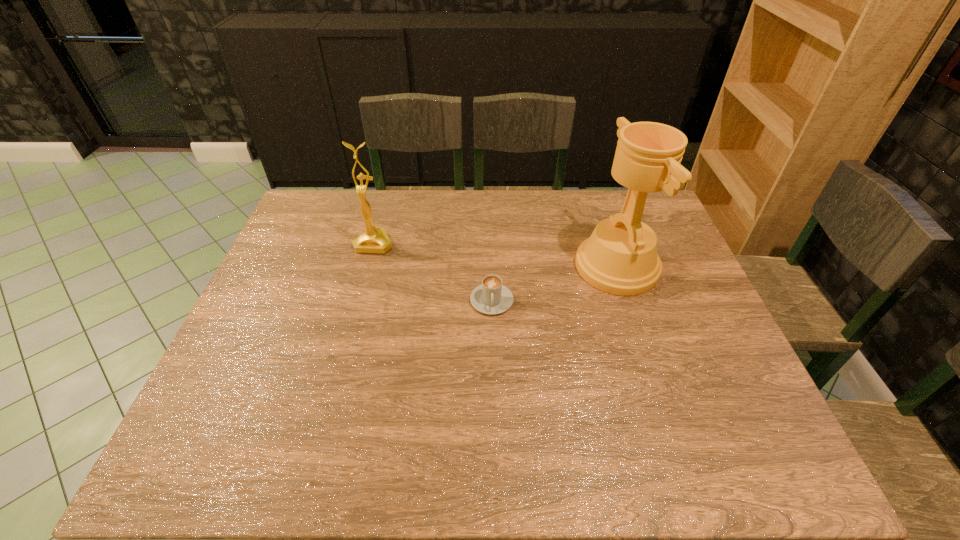
Find the location of a particular element. This screenshot has width=960, height=540. object situated at the right edge is located at coordinates (620, 257).

Locate an element on the screen. This screenshot has height=540, width=960. free space at the far edge is located at coordinates (564, 222).

Find the location of a particular element. This screenshot has height=540, width=960. vacant space at the near edge is located at coordinates (x=358, y=461).

Where is `blank space at the left edge of the desktop`? The width and height of the screenshot is (960, 540). blank space at the left edge of the desktop is located at coordinates click(x=297, y=252).

In the image, there is a desktop. Identify the location of vacant space at the far left corner. The height and width of the screenshot is (540, 960). (326, 198).

Identify the location of free space between the second object from right to left and the left award. (433, 272).

The width and height of the screenshot is (960, 540). Find the location of `vacant area that lies between the second object from left to right and the leftmost object`. vacant area that lies between the second object from left to right and the leftmost object is located at coordinates (433, 272).

In order to click on empty location between the cappuccino and the second shortest object in this screenshot , I will do `click(433, 272)`.

Where is `empty space that is in between the shortest object and the shorter award`? empty space that is in between the shortest object and the shorter award is located at coordinates (433, 272).

Find the location of a particular element. This screenshot has height=540, width=960. vacant space that is in between the rightmost object and the second object from right to left is located at coordinates (554, 284).